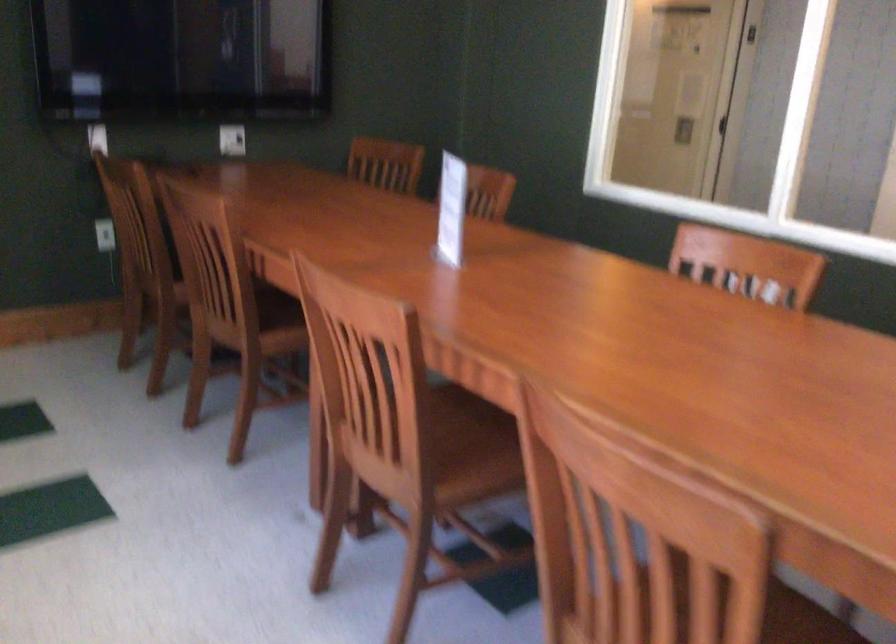
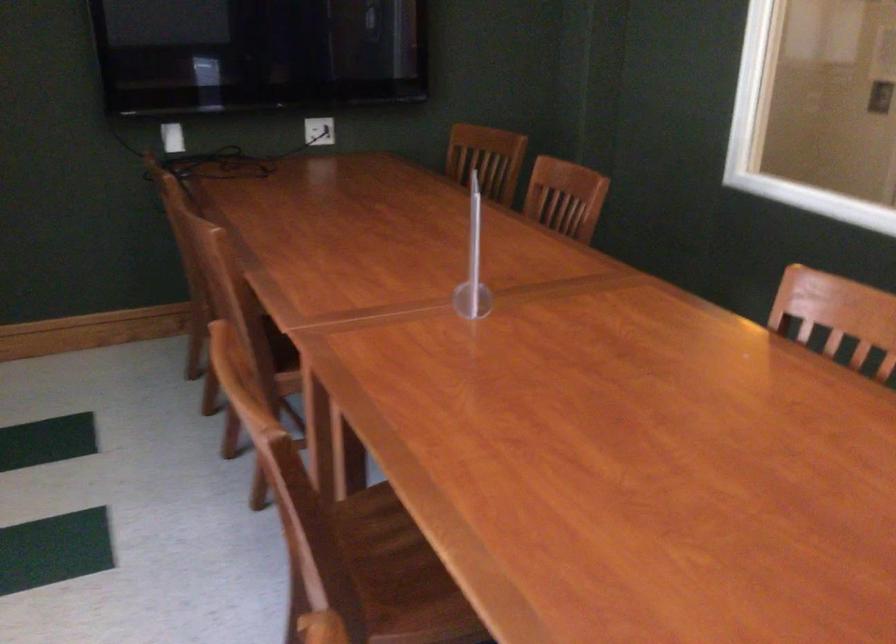
The point at (384, 167) is marked in the first image. Where is the corresponding point in the second image?

(487, 158)